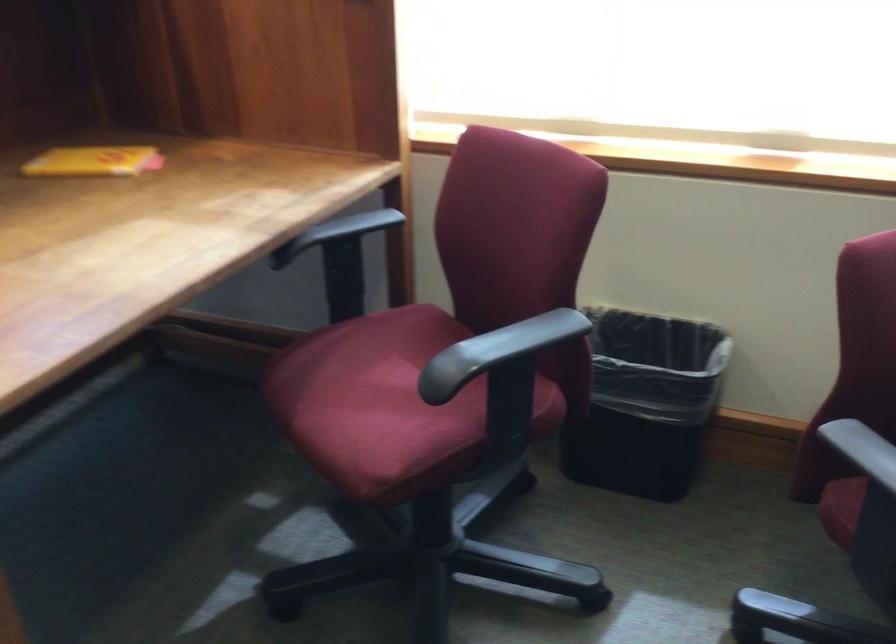
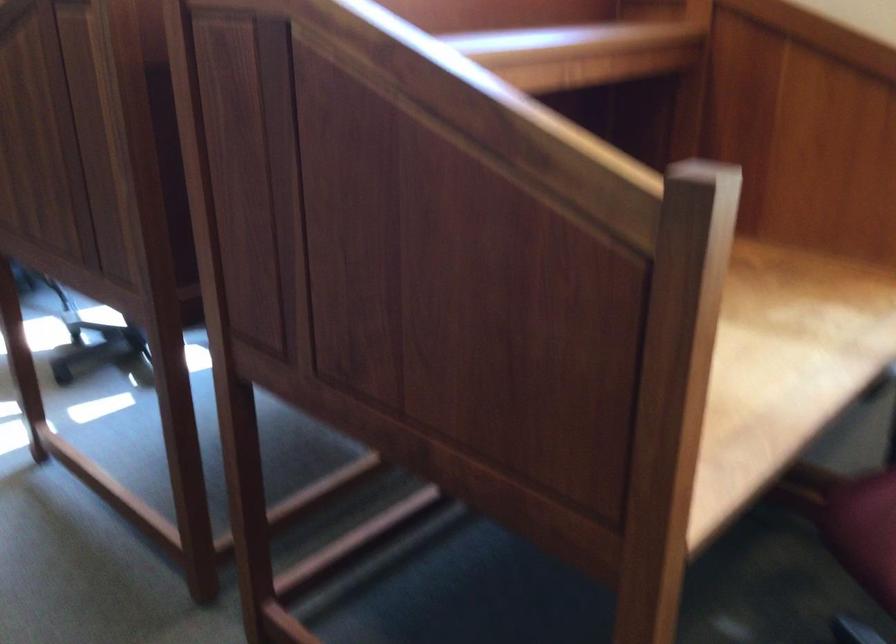
Question: The camera is either moving clockwise (left) or counter-clockwise (right) around the object. The first image is from the beginning of the video and the second image is from the end. Is the camera moving left or right when shooting the video?

Choices:
 (A) Left
 (B) Right

Answer: (B)